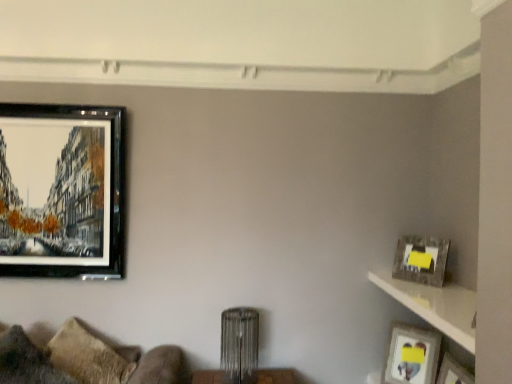
What is the approximate width of velvet beige couch at lower left?

It is 14.86 inches.

The width and height of the screenshot is (512, 384). What do you see at coordinates (421, 259) in the screenshot? I see `matte gray picture frame at upper right, placed as the 2th picture frame when sorted from bottom to top` at bounding box center [421, 259].

The width and height of the screenshot is (512, 384). Describe the element at coordinates (412, 355) in the screenshot. I see `matte silver picture frame at right, the 3th picture frame in the top-to-bottom sequence` at that location.

The width and height of the screenshot is (512, 384). What do you see at coordinates (26, 361) in the screenshot? I see `textured brown pillow at lower left` at bounding box center [26, 361].

Where is `matte black picture frame at upper left, acting as the 3th picture frame starting from the right`? matte black picture frame at upper left, acting as the 3th picture frame starting from the right is located at coordinates [62, 191].

Where is `shelf on the right side of matte black picture frame at upper left, which appears as the 1th picture frame when viewed from the top`? The height and width of the screenshot is (384, 512). shelf on the right side of matte black picture frame at upper left, which appears as the 1th picture frame when viewed from the top is located at coordinates pos(435,305).

Which is correct: matte gray shelf at right is inside matte black picture frame at upper left, placed as the 3th picture frame when sorted from bottom to top, or outside of it?

matte gray shelf at right is not inside matte black picture frame at upper left, placed as the 3th picture frame when sorted from bottom to top, it's outside.

From the picture: Can you tell me how much matte gray shelf at right and matte black picture frame at upper left, the 1th picture frame viewed from the left, differ in facing direction?

The angular difference between matte gray shelf at right and matte black picture frame at upper left, the 1th picture frame viewed from the left, is 90.7 degrees.

Considering the sizes of objects matte gray shelf at right and matte black picture frame at upper left, which appears as the 1th picture frame when viewed from the top, in the image provided, who is thinner, matte gray shelf at right or matte black picture frame at upper left, which appears as the 1th picture frame when viewed from the top,?

With smaller width is matte black picture frame at upper left, which appears as the 1th picture frame when viewed from the top.

Could you tell me if matte gray picture frame at upper right, placed as the 2th picture frame when sorted from bottom to top, is facing textured brown pillow at lower left?

No, matte gray picture frame at upper right, placed as the 2th picture frame when sorted from bottom to top, is not aimed at textured brown pillow at lower left.

Can you confirm if matte gray picture frame at upper right, which ranks as the second picture frame in top-to-bottom order, is wider than textured brown pillow at lower left?

No.

From the image's perspective, is matte gray picture frame at upper right, which is the 1th picture frame in right-to-left order, above or below textured brown pillow at lower left?

Based on their image positions, matte gray picture frame at upper right, which is the 1th picture frame in right-to-left order, is located above textured brown pillow at lower left.

Can we say matte silver picture frame at right, marked as the 2th picture frame in a right-to-left arrangement, lies outside velvet beige couch at lower left?

matte silver picture frame at right, marked as the 2th picture frame in a right-to-left arrangement, lies outside velvet beige couch at lower left's area.

Looking at the image, does matte silver picture frame at right, the 3th picture frame in the top-to-bottom sequence, seem bigger or smaller compared to velvet beige couch at lower left?

matte silver picture frame at right, the 3th picture frame in the top-to-bottom sequence, is smaller than velvet beige couch at lower left.

Is matte silver picture frame at right, the 3th picture frame in the top-to-bottom sequence, far from velvet beige couch at lower left?

Yes, matte silver picture frame at right, the 3th picture frame in the top-to-bottom sequence, and velvet beige couch at lower left are located far from each other.

Locate an element on the screen. the 2nd picture frame in front of the matte black picture frame at upper left, placed as the 3th picture frame when sorted from bottom to top, starting your count from the anchor is located at coordinates coord(421,259).

Based on the photo, is matte black picture frame at upper left, placed as the 3th picture frame when sorted from bottom to top, positioned beyond the bounds of matte gray picture frame at upper right, the 3th picture frame in the left-to-right sequence?

Indeed, matte black picture frame at upper left, placed as the 3th picture frame when sorted from bottom to top, is completely outside matte gray picture frame at upper right, the 3th picture frame in the left-to-right sequence.

From a real-world perspective, between matte black picture frame at upper left, which appears as the 1th picture frame when viewed from the top, and matte gray picture frame at upper right, the 3th picture frame in the left-to-right sequence, who is vertically higher?

From a 3D spatial view, matte black picture frame at upper left, which appears as the 1th picture frame when viewed from the top, is above.

Between matte black picture frame at upper left, acting as the 3th picture frame starting from the right, and matte gray picture frame at upper right, placed as the 2th picture frame when sorted from bottom to top, which one has smaller size?

Smaller between the two is matte gray picture frame at upper right, placed as the 2th picture frame when sorted from bottom to top.

Could you tell me if matte gray shelf at right is turned towards matte silver picture frame at right, the 2th picture frame from the left?

No, matte gray shelf at right does not turn towards matte silver picture frame at right, the 2th picture frame from the left.

From a real-world perspective, which object stands above the other?

From a 3D spatial view, matte gray shelf at right is above.

Can you confirm if matte gray shelf at right is smaller than matte silver picture frame at right, the 3th picture frame in the top-to-bottom sequence?

No.

Is matte gray shelf at right far away from matte silver picture frame at right, the 2th picture frame from the left?

matte gray shelf at right is near matte silver picture frame at right, the 2th picture frame from the left, not far away.

Can you confirm if matte gray picture frame at upper right, placed as the 2th picture frame when sorted from bottom to top, is thinner than matte black picture frame at upper left, acting as the 3th picture frame starting from the right?

In fact, matte gray picture frame at upper right, placed as the 2th picture frame when sorted from bottom to top, might be wider than matte black picture frame at upper left, acting as the 3th picture frame starting from the right.

Which is nearer, (425, 274) or (83, 194)?

Positioned in front is point (425, 274).

Considering the sizes of matte gray picture frame at upper right, the 3th picture frame in the left-to-right sequence, and matte black picture frame at upper left, placed as the 3th picture frame when sorted from bottom to top, in the image, is matte gray picture frame at upper right, the 3th picture frame in the left-to-right sequence, taller or shorter than matte black picture frame at upper left, placed as the 3th picture frame when sorted from bottom to top,?

Considering their sizes, matte gray picture frame at upper right, the 3th picture frame in the left-to-right sequence, has less height than matte black picture frame at upper left, placed as the 3th picture frame when sorted from bottom to top.

Which of these two, matte black picture frame at upper left, which appears as the 1th picture frame when viewed from the top, or matte silver picture frame at right, the 3th picture frame in the top-to-bottom sequence, is smaller?

With smaller size is matte silver picture frame at right, the 3th picture frame in the top-to-bottom sequence.

From a real-world perspective, is matte black picture frame at upper left, placed as the 3th picture frame when sorted from bottom to top, physically above matte silver picture frame at right, the 2th picture frame from the left?

Correct, in the physical world, matte black picture frame at upper left, placed as the 3th picture frame when sorted from bottom to top, is higher than matte silver picture frame at right, the 2th picture frame from the left.

There is a matte black picture frame at upper left, which appears as the 1th picture frame when viewed from the top. What are the coordinates of `the 2nd picture frame below it (from the image's perspective)` in the screenshot? It's located at (412, 355).

Considering the points (19, 156) and (424, 371), which point is behind, point (19, 156) or point (424, 371)?

The point (19, 156) is farther.

Image resolution: width=512 pixels, height=384 pixels. In order to click on shelf in front of the matte black picture frame at upper left, acting as the 3th picture frame starting from the right in this screenshot , I will do `click(435, 305)`.

I want to click on the 1st picture frame directly above the textured brown pillow at lower left (from a real-world perspective), so click(x=421, y=259).

Estimate the real-world distances between objects in this image. Which object is further from matte gray shelf at right, matte silver picture frame at right, marked as the 2th picture frame in a right-to-left arrangement, or matte black picture frame at upper left, acting as the 3th picture frame starting from the right?

Among the two, matte black picture frame at upper left, acting as the 3th picture frame starting from the right, is located further to matte gray shelf at right.

When comparing their distances from matte black picture frame at upper left, the 1th picture frame viewed from the left, does velvet beige couch at lower left or textured brown pillow at lower left seem closer?

Based on the image, velvet beige couch at lower left appears to be nearer to matte black picture frame at upper left, the 1th picture frame viewed from the left.

Estimate the real-world distances between objects in this image. Which object is closer to matte gray picture frame at upper right, which ranks as the second picture frame in top-to-bottom order, matte gray shelf at right or matte silver picture frame at right, the 3th picture frame in the top-to-bottom sequence?

The object closer to matte gray picture frame at upper right, which ranks as the second picture frame in top-to-bottom order, is matte gray shelf at right.

When comparing their distances from velvet beige couch at lower left, does matte gray shelf at right or matte silver picture frame at right, the first picture frame when ordered from bottom to top, seem closer?

matte silver picture frame at right, the first picture frame when ordered from bottom to top.

Which object lies further to the anchor point matte black picture frame at upper left, the 1th picture frame viewed from the left, textured brown pillow at lower left or matte gray picture frame at upper right, which is the 1th picture frame in right-to-left order?

Among the two, matte gray picture frame at upper right, which is the 1th picture frame in right-to-left order, is located further to matte black picture frame at upper left, the 1th picture frame viewed from the left.

Which object lies further to the anchor point matte gray picture frame at upper right, which ranks as the second picture frame in top-to-bottom order, matte silver picture frame at right, marked as the 2th picture frame in a right-to-left arrangement, or velvet beige couch at lower left?

The object further to matte gray picture frame at upper right, which ranks as the second picture frame in top-to-bottom order, is velvet beige couch at lower left.

Considering their positions, is textured brown pillow at lower left positioned closer to velvet beige couch at lower left than matte gray picture frame at upper right, which ranks as the second picture frame in top-to-bottom order?

textured brown pillow at lower left lies closer to velvet beige couch at lower left than the other object.

Estimate the real-world distances between objects in this image. Which object is further from matte silver picture frame at right, marked as the 2th picture frame in a right-to-left arrangement, velvet beige couch at lower left or matte gray shelf at right?

Among the two, velvet beige couch at lower left is located further to matte silver picture frame at right, marked as the 2th picture frame in a right-to-left arrangement.

Find the location of a particular element. shelf located between textured brown pillow at lower left and matte gray picture frame at upper right, which ranks as the second picture frame in top-to-bottom order, in the left-right direction is located at coordinates (435, 305).

Where is `couch between matte black picture frame at upper left, the 1th picture frame viewed from the left, and matte gray picture frame at upper right, placed as the 2th picture frame when sorted from bottom to top, in the horizontal direction`? The image size is (512, 384). couch between matte black picture frame at upper left, the 1th picture frame viewed from the left, and matte gray picture frame at upper right, placed as the 2th picture frame when sorted from bottom to top, in the horizontal direction is located at coordinates (79, 363).

In order to click on picture frame between velvet beige couch at lower left and matte gray picture frame at upper right, which ranks as the second picture frame in top-to-bottom order, from left to right in this screenshot , I will do `click(412, 355)`.

This screenshot has width=512, height=384. I want to click on couch between textured brown pillow at lower left and matte gray shelf at right in the horizontal direction, so click(79, 363).